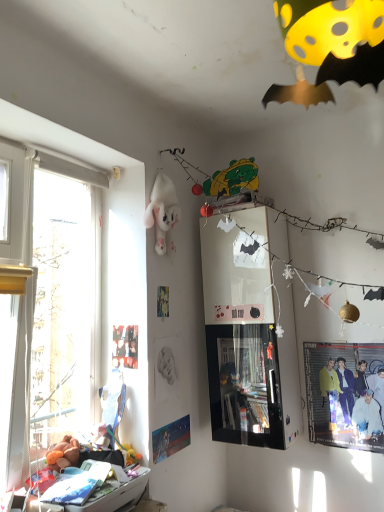
Question: From the image's perspective, is fluffy orange teddy bear at lower left, the second toy viewed from the right, above or below matte black poster at upper left, the second poster page positioned from the right?

Choices:
 (A) above
 (B) below

Answer: (B)

Question: Visually, is fluffy orange teddy bear at lower left, the first toy positioned from the left, positioned to the left or to the right of matte black poster at upper left, the first poster page from the left?

Choices:
 (A) left
 (B) right

Answer: (A)

Question: Estimate the real-world distances between objects in this image. Which object is closer to the white plastic drawer at lower left?

Choices:
 (A) fluffy orange teddy bear at lower left, the second toy viewed from the right
 (B) matte black poster at upper left, which is counted as the first poster page, starting from the top
 (C) white plush toy at upper center, the second toy when ordered from left to right
 (D) matte blue poster at lower left, which is the first poster page in right-to-left order
 (E) matte yellow jacket at lower right

Answer: (A)

Question: Based on their relative distances, which object is farther from the matte blue poster at lower left, the second poster page from the left?

Choices:
 (A) matte black poster at upper left, the first poster page from the left
 (B) white plastic drawer at lower left
 (C) fluffy orange teddy bear at lower left, the first toy positioned from the left
 (D) matte yellow jacket at lower right
 (E) white plush toy at upper center, which appears as the second toy when ordered from the bottom

Answer: (E)